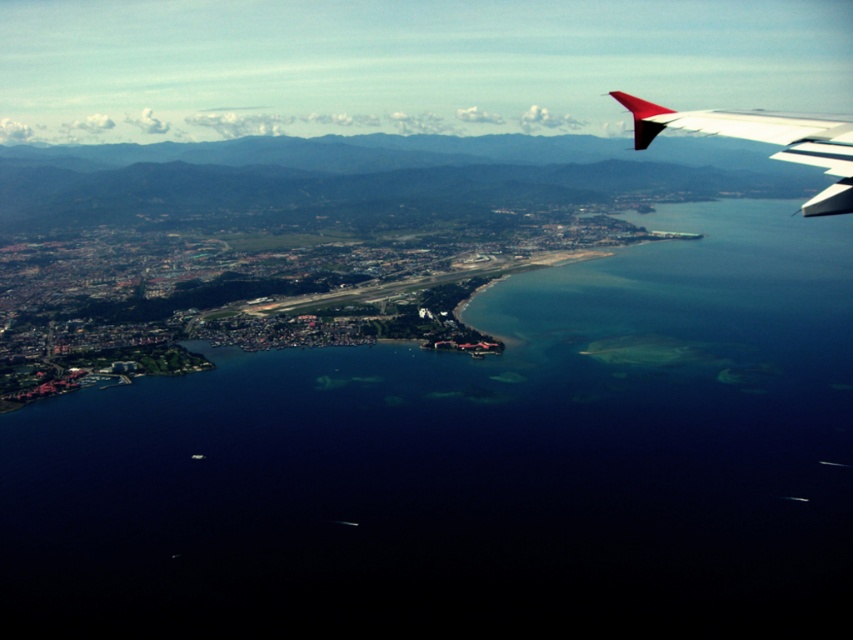
Question: Does clear blue water at center have a lesser width compared to metallic winglet at upper right?

Choices:
 (A) no
 (B) yes

Answer: (A)

Question: Among these objects, which one is farthest from the camera?

Choices:
 (A) clear blue water at center
 (B) metallic winglet at upper right

Answer: (A)

Question: Does clear blue water at center appear over metallic winglet at upper right?

Choices:
 (A) no
 (B) yes

Answer: (A)

Question: Which of the following is the farthest from the observer?

Choices:
 (A) clear blue water at center
 (B) metallic winglet at upper right

Answer: (A)

Question: Does clear blue water at center have a smaller size compared to metallic winglet at upper right?

Choices:
 (A) no
 (B) yes

Answer: (B)